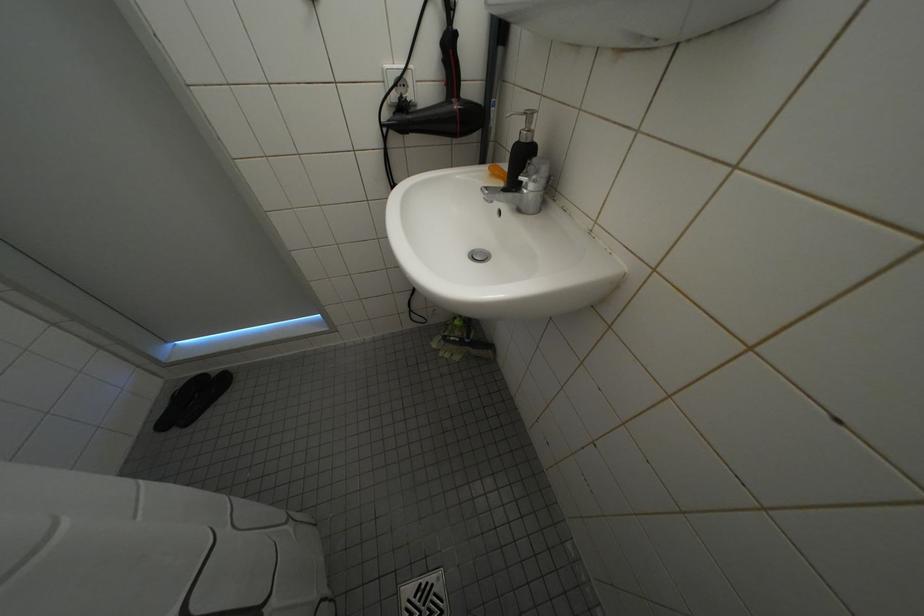
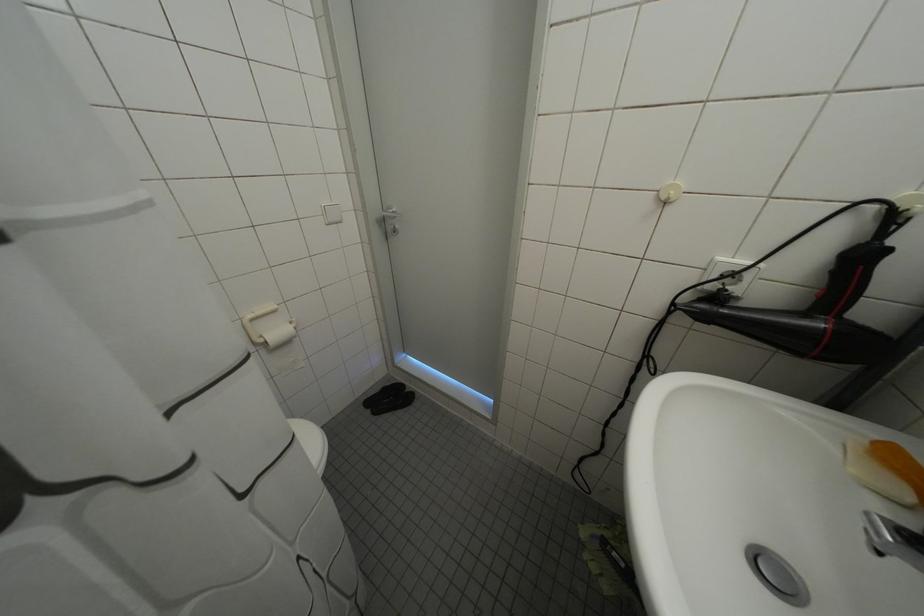
Question: The images are taken continuously from a first-person perspective. In which direction is your viewpoint rotating?

Choices:
 (A) Left
 (B) Right
 (C) Up
 (D) Down

Answer: (A)